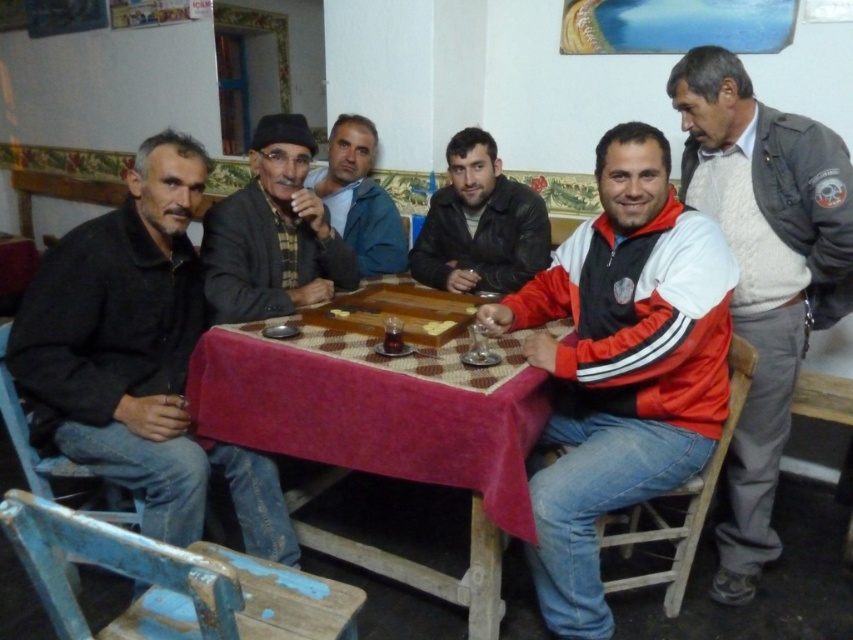
Question: Which point is farther to the camera?

Choices:
 (A) (469, 168)
 (B) (398, 333)
 (C) (373, 147)

Answer: (C)

Question: Considering the relative positions of black matte jacket at left and dark gray knit cap at center in the image provided, where is black matte jacket at left located with respect to dark gray knit cap at center?

Choices:
 (A) below
 (B) above

Answer: (A)

Question: Which object is the farthest from the black matte jacket at left?

Choices:
 (A) red and white jacket at center
 (B) leather jacket at center
 (C) wooden checkered table at center
 (D) gray wool sweater at upper right

Answer: (D)

Question: Is red and white jacket at center above translucent glass cup at table center?

Choices:
 (A) yes
 (B) no

Answer: (B)

Question: Which point is farther to the camera?

Choices:
 (A) (383, 337)
 (B) (363, 435)
 (C) (447, 284)
 (D) (677, 372)

Answer: (C)

Question: Does dark gray knit cap at center have a greater width compared to dark blue fabric at center?

Choices:
 (A) yes
 (B) no

Answer: (A)